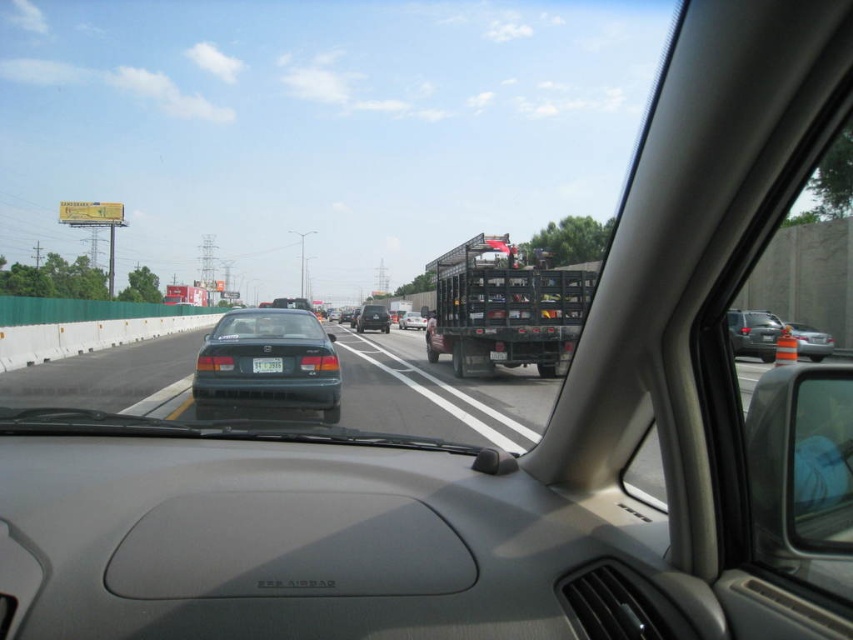
You are driving a car and see two sedans ahead on the highway. The matte black sedan at center and the green matte sedan at center are both in your path. How far apart are these two sedans from each other?

The matte black sedan at center and the green matte sedan at center are 6.42 meters apart from each other.

You are driving a car and see the matte black sedan at center and the green matte sedan at center ahead on the highway. Which one is positioned more to the left side of the road?

The matte black sedan at center is positioned more to the left side of the road because it is to the left of the green matte sedan at center.

You are a passenger in a car and looking at the road ahead. You notice two sedans ahead of us. Which one is closer to our car, the glossy dark green sedan at center or the green matte sedan at center?

The glossy dark green sedan at center is closer to our car because it is located below the green matte sedan at center, indicating it is positioned lower in the visual field, which typically corresponds to being nearer when viewing from the car.